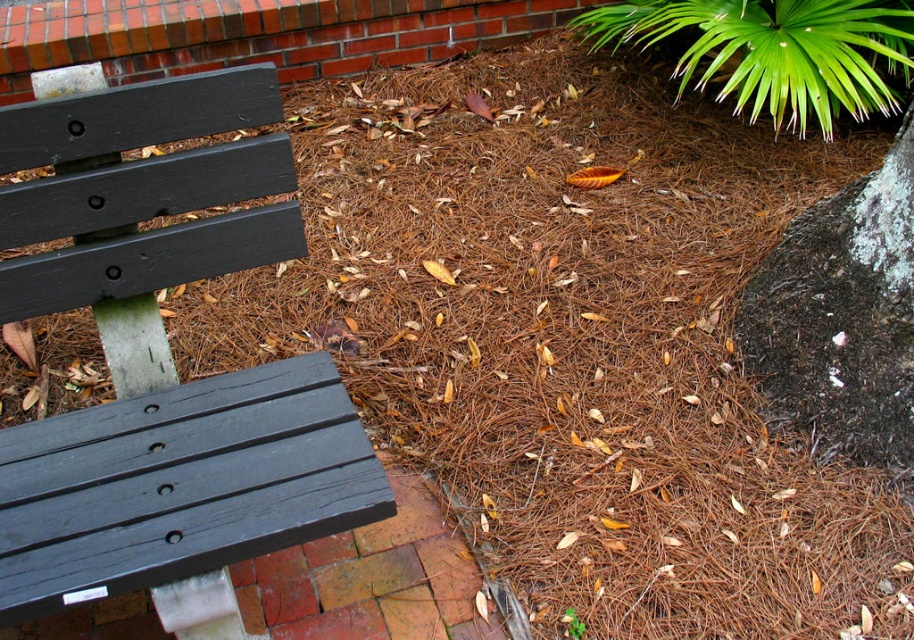
Question: Does matte black bench at left appear over green leafy plant at upper right?

Choices:
 (A) no
 (B) yes

Answer: (A)

Question: Does matte black bench at left come in front of green leafy plant at upper right?

Choices:
 (A) no
 (B) yes

Answer: (B)

Question: Is matte black bench at left closer to the viewer compared to green leafy plant at upper right?

Choices:
 (A) yes
 (B) no

Answer: (A)

Question: Which of the following is the closest to the observer?

Choices:
 (A) matte black bench at left
 (B) green leafy plant at upper right

Answer: (A)

Question: Which of the following is the closest to the observer?

Choices:
 (A) (664, 17)
 (B) (36, 280)

Answer: (B)